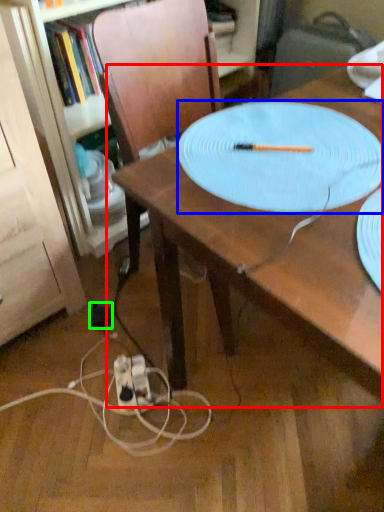
Question: Which object is positioned farthest from table (highlighted by a red box)? Select from platter (highlighted by a blue box) and electric outlet (highlighted by a green box).

Choices:
 (A) platter
 (B) electric outlet

Answer: (B)